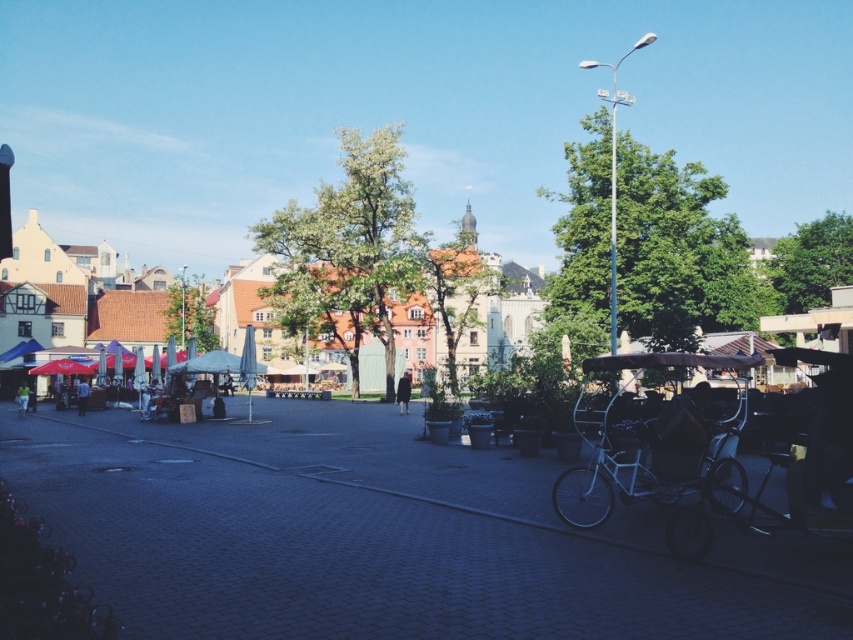
Question: Which object appears farthest from the camera in this image?

Choices:
 (A) black wool coat at center
 (B) green fabric umbrella at lower left
 (C) wooden tables at center
 (D) light blue shirt at center

Answer: (A)

Question: Is metallic silver rickshaw at right thinner than blue fabric canopy at left?

Choices:
 (A) yes
 (B) no

Answer: (B)

Question: Among these objects, which one is nearest to the camera?

Choices:
 (A) wooden tables at center
 (B) light blue shirt at center
 (C) green fabric umbrella at lower left
 (D) blue fabric canopy at left

Answer: (A)

Question: Which point is closer to the camera?

Choices:
 (A) (404, 378)
 (B) (15, 346)
 (C) (82, 392)

Answer: (C)

Question: Does wooden tables at center have a smaller size compared to green fabric umbrella at lower left?

Choices:
 (A) no
 (B) yes

Answer: (A)

Question: Is wooden tables at center below light blue shirt at center?

Choices:
 (A) no
 (B) yes

Answer: (A)